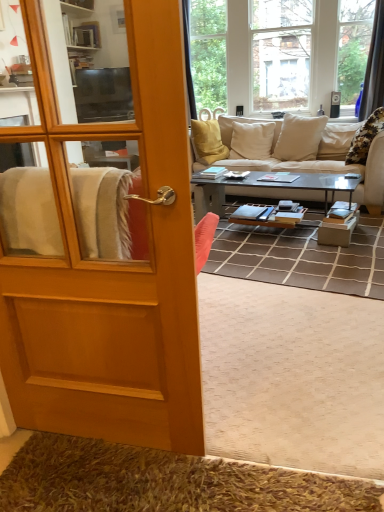
Question: From a real-world perspective, relative to wooden door at left, is metallic gray coffee table at center vertically above or below?

Choices:
 (A) below
 (B) above

Answer: (A)

Question: Considering their positions, is metallic gray coffee table at center located in front of or behind wooden door at left?

Choices:
 (A) front
 (B) behind

Answer: (B)

Question: Which object is positioned closest to the wooden door at left?

Choices:
 (A) brown shaggy rug at lower left
 (B) beige fabric couch at center
 (C) matte black television at upper left
 (D) metallic gray coffee table at center

Answer: (A)

Question: Which is farther from the wooden door at left?

Choices:
 (A) beige fabric couch at center
 (B) matte black television at upper left
 (C) metallic gray coffee table at center
 (D) brown shaggy rug at lower left

Answer: (B)